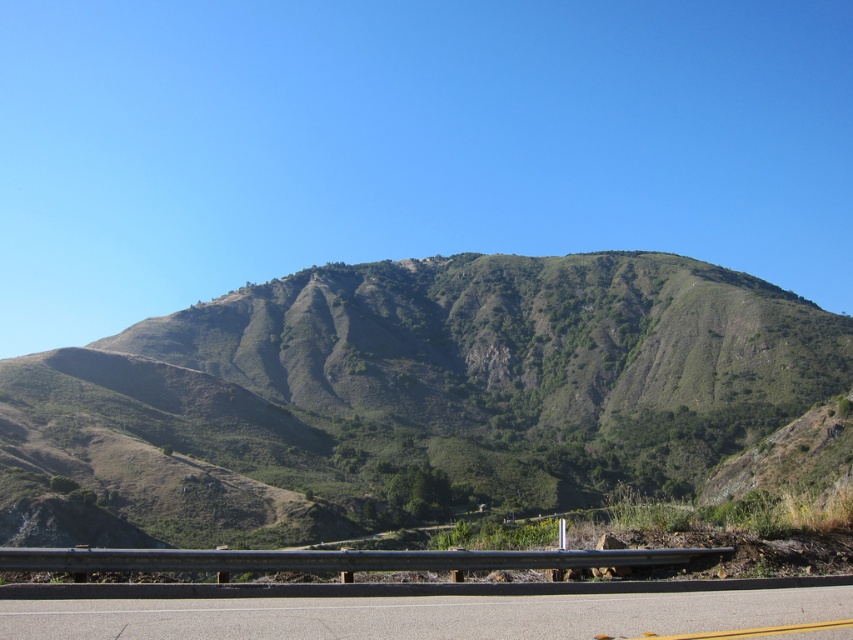
Is point (210, 480) behind point (540, 608)?

That is True.

From the picture: Which of these two, green grassy mountain at center or asphalt road at center, stands taller?

With more height is green grassy mountain at center.

I want to click on green grassy mountain at center, so click(410, 396).